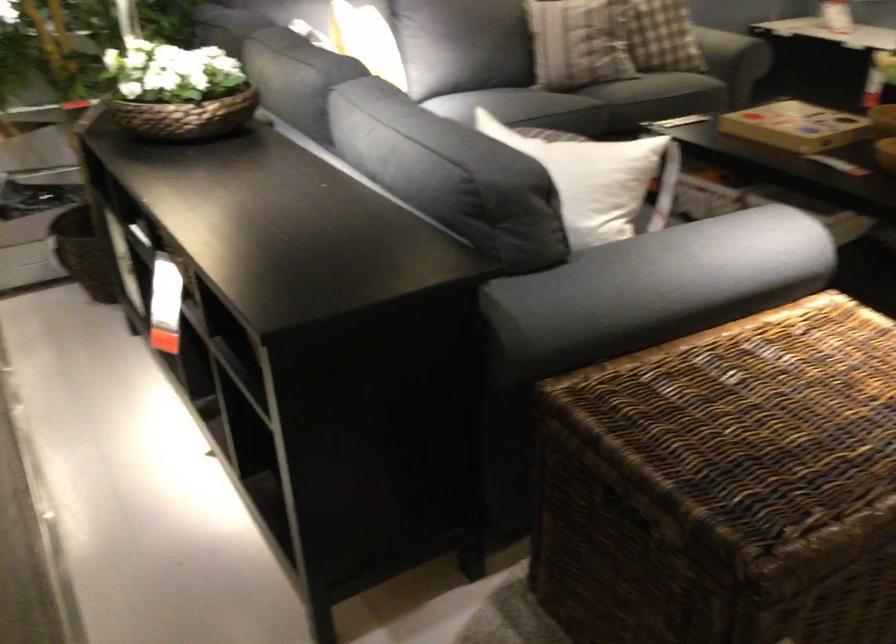
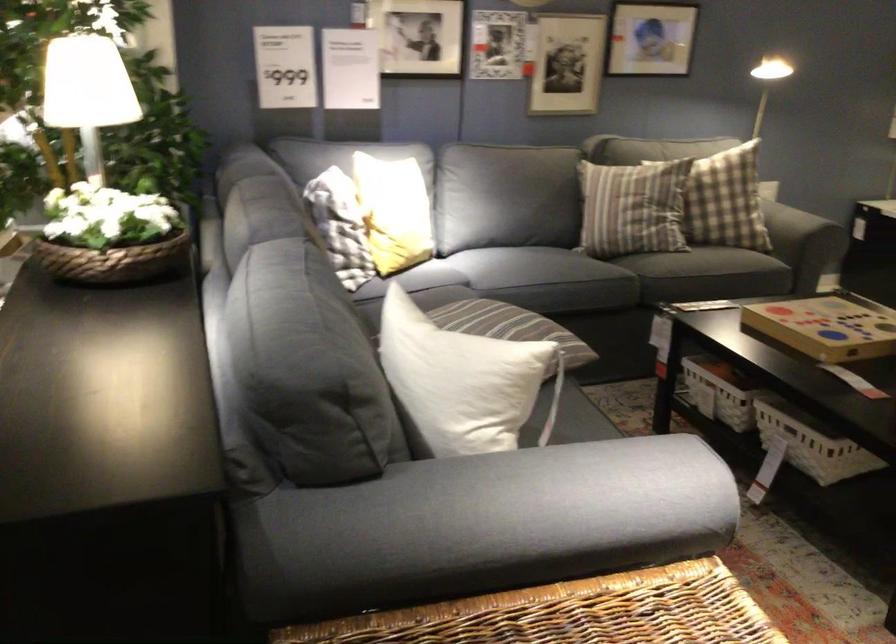
In the second image, find the point that corresponds to point 812,120 in the first image.

(828, 326)